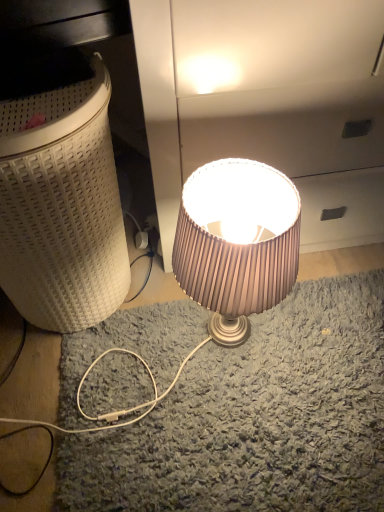
Question: Considering the relative sizes of satin beige lampshade at center and white woven laundry basket at left in the image provided, is satin beige lampshade at center smaller than white woven laundry basket at left?

Choices:
 (A) no
 (B) yes

Answer: (B)

Question: Is white woven laundry basket at left at the back of satin beige lampshade at center?

Choices:
 (A) yes
 (B) no

Answer: (B)

Question: Considering the relative sizes of satin beige lampshade at center and white woven laundry basket at left in the image provided, is satin beige lampshade at center bigger than white woven laundry basket at left?

Choices:
 (A) yes
 (B) no

Answer: (B)

Question: From a real-world perspective, does satin beige lampshade at center stand above white woven laundry basket at left?

Choices:
 (A) no
 (B) yes

Answer: (A)

Question: Does satin beige lampshade at center come in front of white woven laundry basket at left?

Choices:
 (A) yes
 (B) no

Answer: (B)

Question: Considering the relative positions of satin beige lampshade at center and white woven laundry basket at left in the image provided, is satin beige lampshade at center to the right of white woven laundry basket at left from the viewer's perspective?

Choices:
 (A) yes
 (B) no

Answer: (A)

Question: Would you consider white woven laundry basket at left to be distant from satin beige lampshade at center?

Choices:
 (A) yes
 (B) no

Answer: (B)

Question: Does white woven laundry basket at left have a larger size compared to satin beige lampshade at center?

Choices:
 (A) yes
 (B) no

Answer: (A)

Question: From the image's perspective, is white woven laundry basket at left located above satin beige lampshade at center?

Choices:
 (A) yes
 (B) no

Answer: (A)

Question: Does white woven laundry basket at left have a greater height compared to satin beige lampshade at center?

Choices:
 (A) yes
 (B) no

Answer: (A)

Question: Would you say satin beige lampshade at center is part of white woven laundry basket at left's contents?

Choices:
 (A) no
 (B) yes

Answer: (A)

Question: Is white woven laundry basket at left oriented away from satin beige lampshade at center?

Choices:
 (A) no
 (B) yes

Answer: (A)

Question: Does point (173, 271) appear closer or farther from the camera than point (31, 273)?

Choices:
 (A) closer
 (B) farther

Answer: (A)